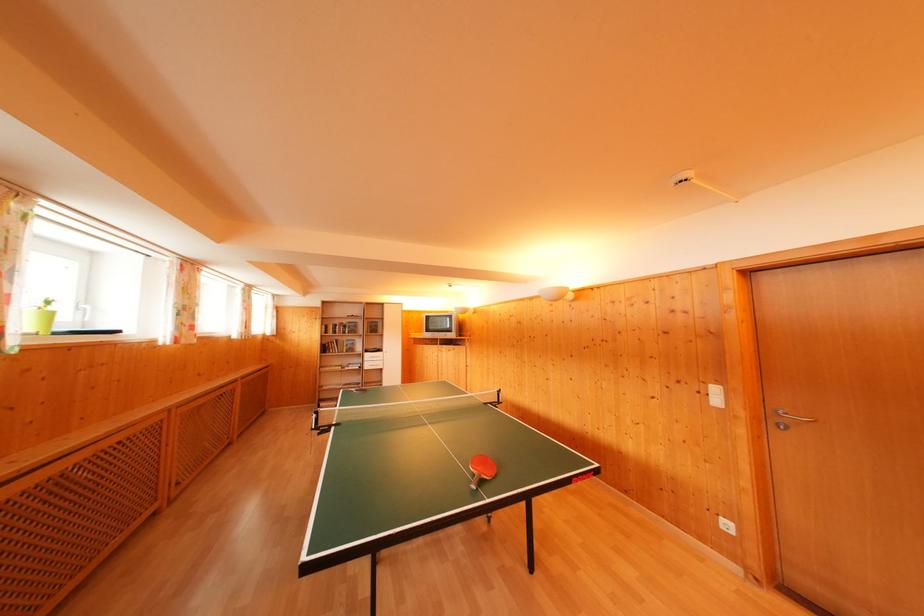
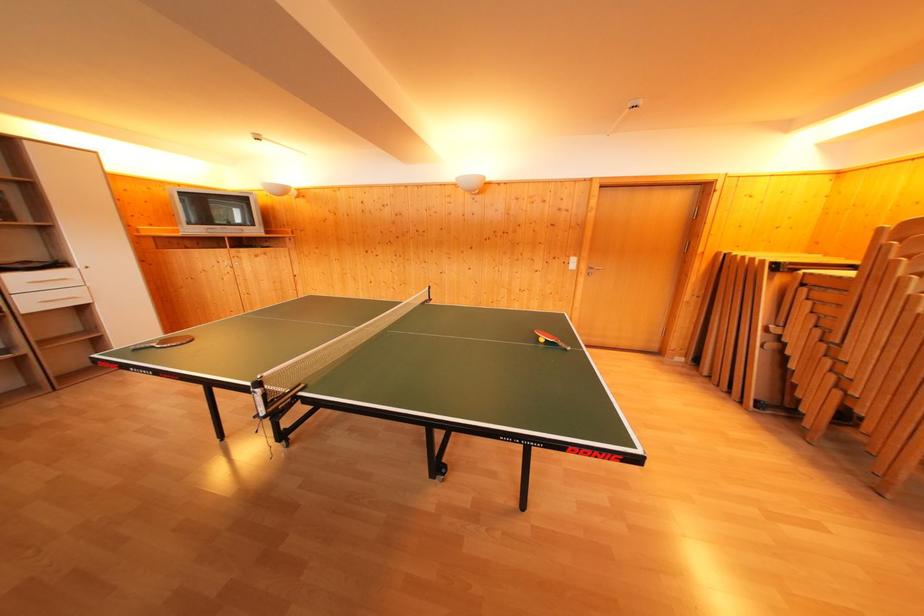
Locate, in the second image, the point that corresponds to [383,355] in the first image.

(64, 270)